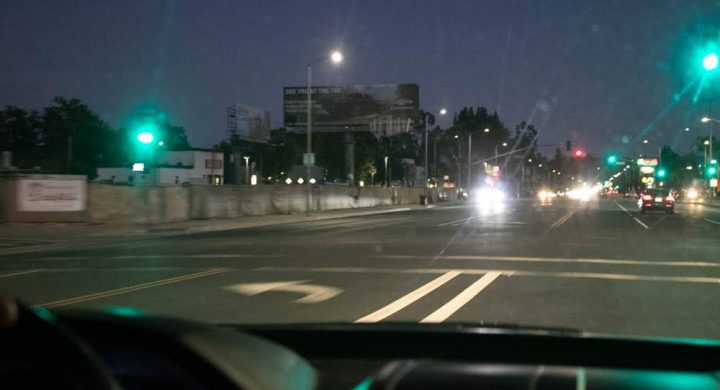
The height and width of the screenshot is (390, 720). I want to click on light, so click(x=711, y=63).